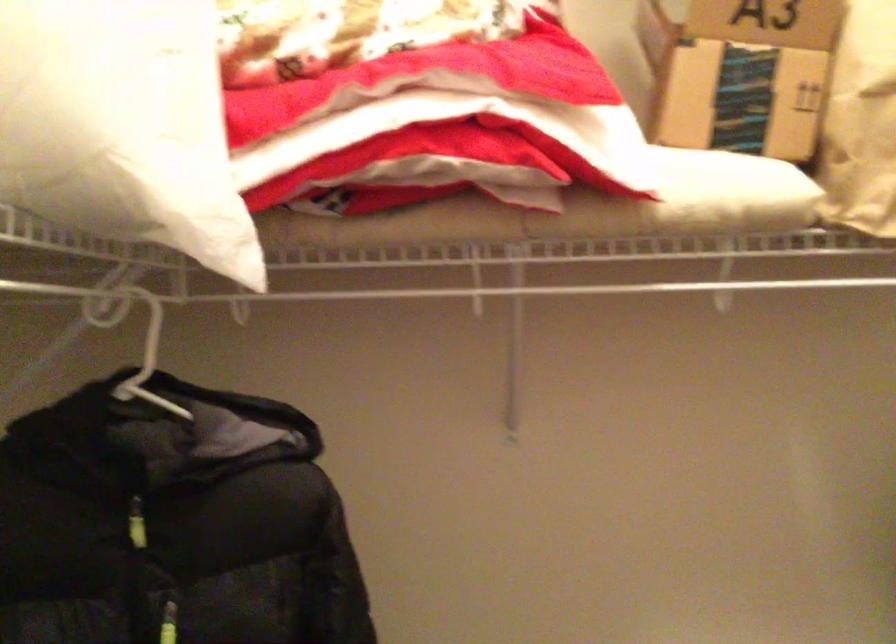
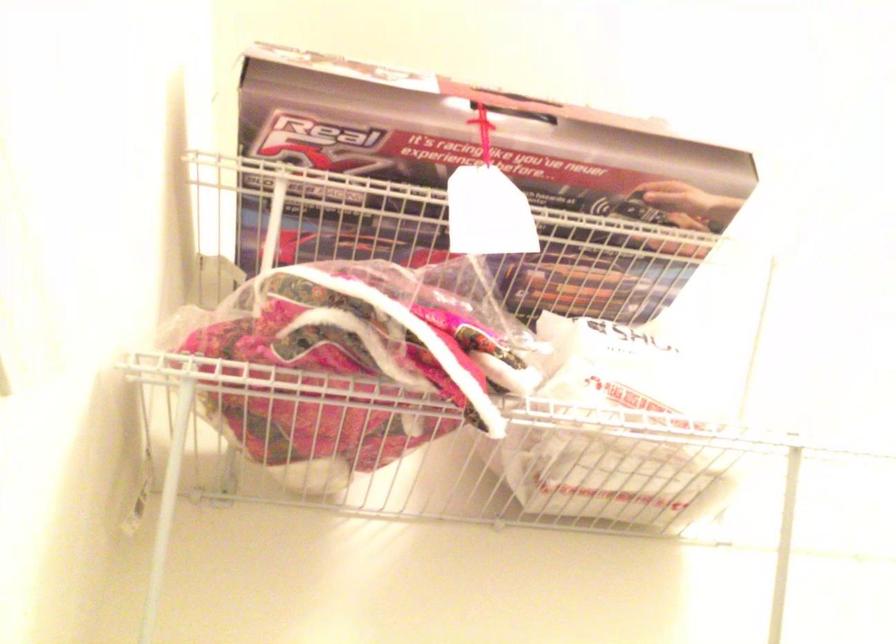
Based on the continuous images, in which direction is the camera rotating?

The rotation direction of the camera is left-up.